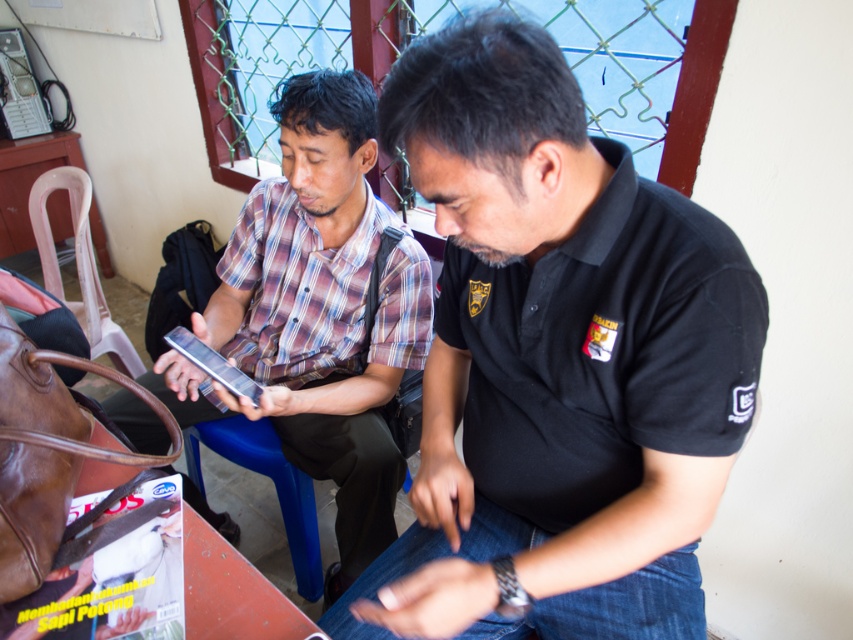
Which is below, black matte shirt at center or plaid shirt at center?

A: plaid shirt at center

Is black matte shirt at center to the right of plaid shirt at center from the viewer's perspective?

Yes, black matte shirt at center is to the right of plaid shirt at center.

Is point (596, 573) closer to camera compared to point (340, 424)?

Yes, point (596, 573) is closer to viewer.

I want to click on black matte shirt at center, so click(x=556, y=362).

Between point (349, 152) and point (245, 387), which one is positioned behind?

The point (349, 152) is more distant.

Between plaid shirt at center and metallic silver phone at center, which one has more height?

plaid shirt at center

This screenshot has height=640, width=853. What do you see at coordinates (317, 314) in the screenshot? I see `plaid shirt at center` at bounding box center [317, 314].

Find the location of a particular element. plaid shirt at center is located at coordinates (317, 314).

Is black matte shirt at center to the left of metallic silver phone at center from the viewer's perspective?

No, black matte shirt at center is not to the left of metallic silver phone at center.

Can you confirm if black matte shirt at center is wider than metallic silver phone at center?

Yes, black matte shirt at center is wider than metallic silver phone at center.

Image resolution: width=853 pixels, height=640 pixels. What are the coordinates of `black matte shirt at center` in the screenshot? It's located at (556, 362).